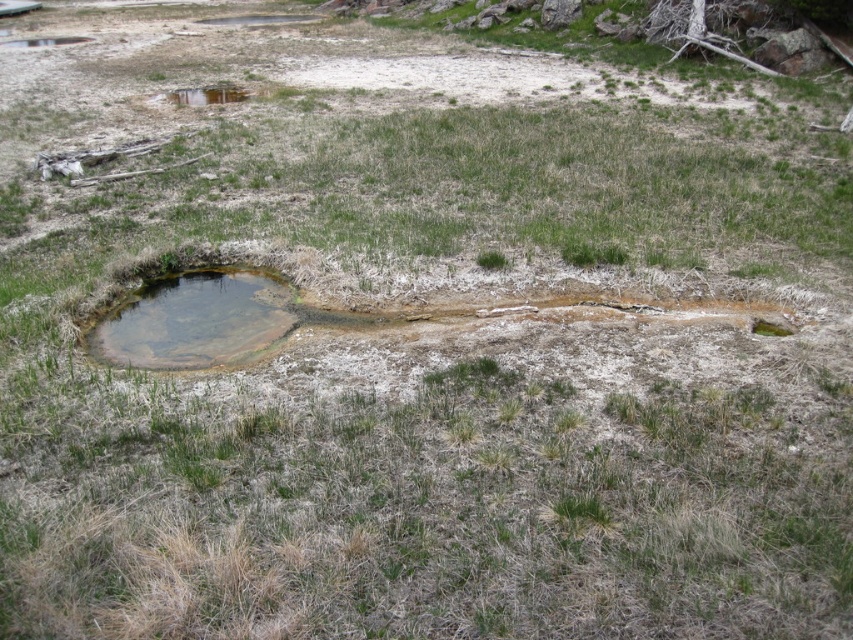
Question: Observing the image, what is the correct spatial positioning of brown sedimentary pool at center in reference to brown sedimentary rock at lower right?

Choices:
 (A) left
 (B) right

Answer: (A)

Question: Which point is farther to the camera?

Choices:
 (A) brown sedimentary rock at lower right
 (B) brown sedimentary pool at center

Answer: (A)

Question: Does brown sedimentary pool at center appear on the right side of brown sedimentary rock at lower right?

Choices:
 (A) no
 (B) yes

Answer: (A)

Question: Does brown sedimentary pool at center appear on the right side of brown sedimentary rock at lower right?

Choices:
 (A) no
 (B) yes

Answer: (A)

Question: Among these points, which one is farthest from the camera?

Choices:
 (A) (773, 326)
 (B) (100, 323)

Answer: (B)